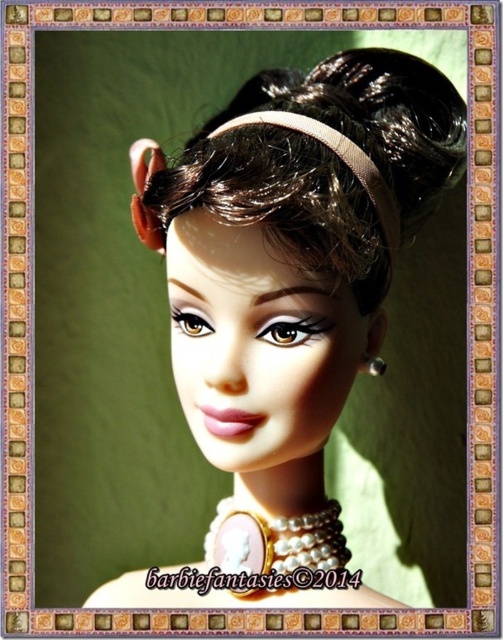
You are a photographer adjusting your camera to focus on the doll. The camera has a focus point at point (191, 163). If the camera requires the focus point to be within 30 inches of the viewer to achieve sharp focus, will this point be in focus?

The point (191, 163) is 33.35 inches from the viewer, which is beyond the camera requirement of 30 inches. Therefore, the focus point will not be sharp.

You are taking a photo of the doll and notice two points on her necklace. The first point is at coordinates point (x=366, y=278) and the second is at point (x=377, y=369). Which point is closer to the camera?

Point (x=366, y=278) is closer to the camera than point (x=377, y=369).

You are a photographer adjusting the focus on your camera. You notice two points in the image of the doll. One is at point [215,349] and the other at point [402,120]. Which point should you focus on to ensure the closest object is sharp?

You should focus on point [215,349] because it is closer to the camera than point [402,120].